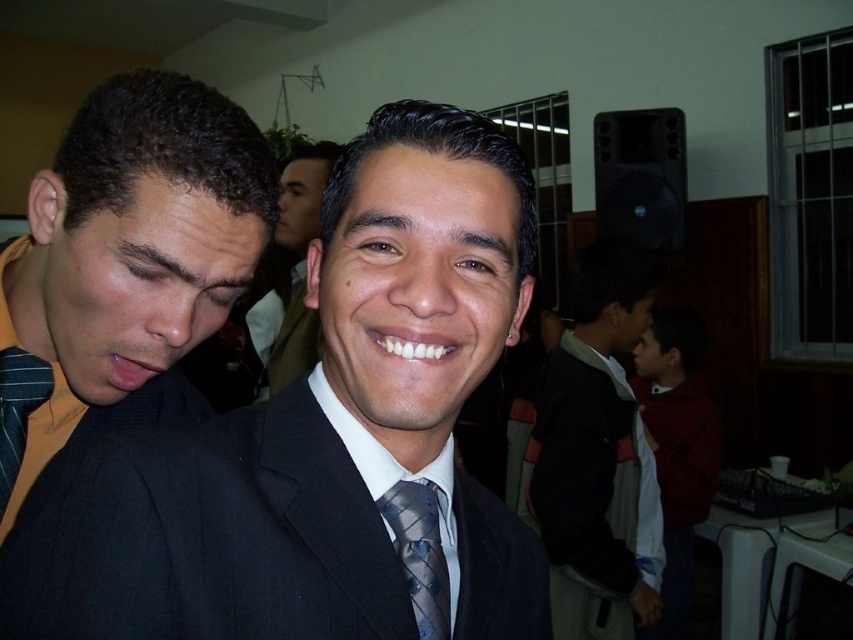
Who is positioned more to the left, black suit at center or matte black suit at left?

Positioned to the left is matte black suit at left.

Does point (386, 140) come behind point (100, 304)?

No, it is in front of (100, 304).

Measure the distance between point [100,600] and camera.

15.87 inches

You are a GUI agent. You are given a task and a screenshot of the screen. Output one action in this format:
    pyautogui.click(x=<x>, y=<y>)
    Task: Click on the black suit at center
    This screenshot has height=640, width=853.
    Given the screenshot: What is the action you would take?
    pyautogui.click(x=318, y=435)

Based on the photo, which of these two, black suit at center or dark suit jacket at center, stands shorter?

With less height is black suit at center.

Does point (433, 188) lie behind point (590, 589)?

No, it is in front of (590, 589).

Identify the location of black suit at center. (318, 435).

Who is lower down, black suit at center or matte black suit at center?

black suit at center

Between point (123, 576) and point (317, 188), which one is positioned in front?

Point (123, 576)

I want to click on black suit at center, so click(x=318, y=435).